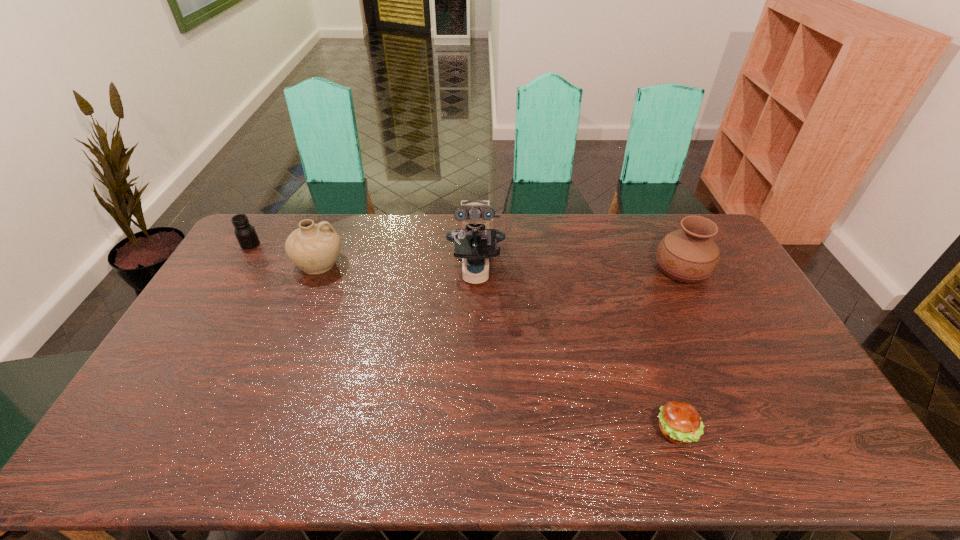
Identify the location of free spot located 0.380m on the right of the fourth object from right to left. This screenshot has height=540, width=960. (450, 264).

Find the location of a particular element. This screenshot has height=540, width=960. free space located on the right of the second shortest object is located at coordinates (286, 244).

Identify the location of vacant space located 0.220m on the right of the shortest object. The height and width of the screenshot is (540, 960). pos(784,430).

Locate an element on the screen. This screenshot has width=960, height=540. microscope that is positioned at the far edge is located at coordinates pyautogui.click(x=475, y=241).

In order to click on urn that is at the far edge in this screenshot , I will do `click(689, 255)`.

The height and width of the screenshot is (540, 960). I want to click on pottery present at the far edge, so pyautogui.click(x=314, y=248).

In order to click on jar situated at the far edge in this screenshot , I will do `click(245, 233)`.

Identify the location of object situated at the near edge. (680, 422).

At what (x,y) coordinates should I click in order to perform the action: click on object present at the left edge. Please return your answer as a coordinate pair (x, y). This screenshot has height=540, width=960. Looking at the image, I should click on (245, 233).

This screenshot has height=540, width=960. What are the coordinates of `object that is positioned at the right edge` in the screenshot? It's located at pyautogui.click(x=689, y=255).